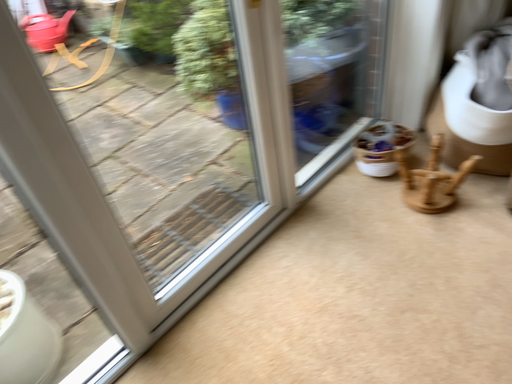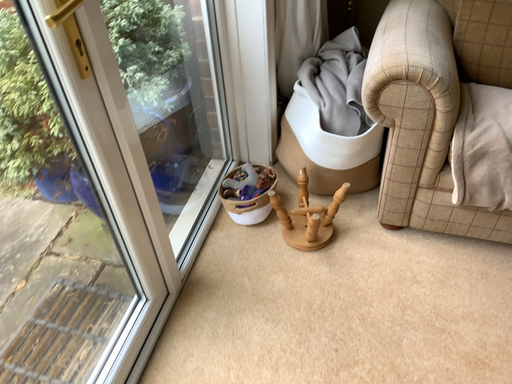
Question: Which way did the camera rotate in the video?

Choices:
 (A) rotated right
 (B) rotated left

Answer: (A)